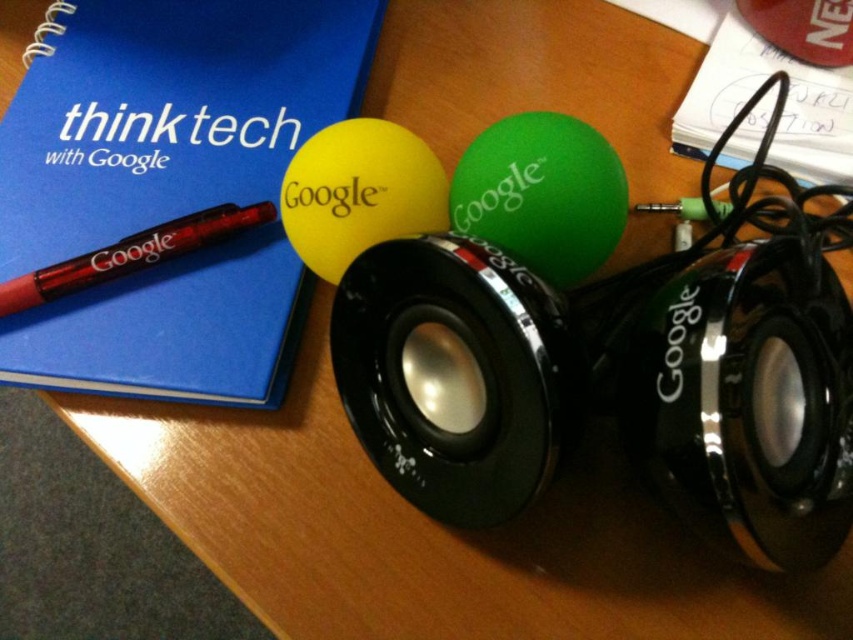
You are organizing items on a desk and need to place a new item between the black metallic speaker at center and the translucent red pen at left. Based on their current positions, where should you place the new item?

The black metallic speaker at center is positioned on the right side of the translucent red pen at left, so the new item should be placed between them, to the right of the translucent red pen at left and to the left of the black metallic speaker at center.

You are organizing items on a wooden desk. You have a yellow rubber balloon at center and a blue notebook with a red pen diagonally across it. Where is the yellow rubber balloon positioned relative to the blue notebook?

The yellow rubber balloon at center is located at point [358,193] relative to the blue notebook.